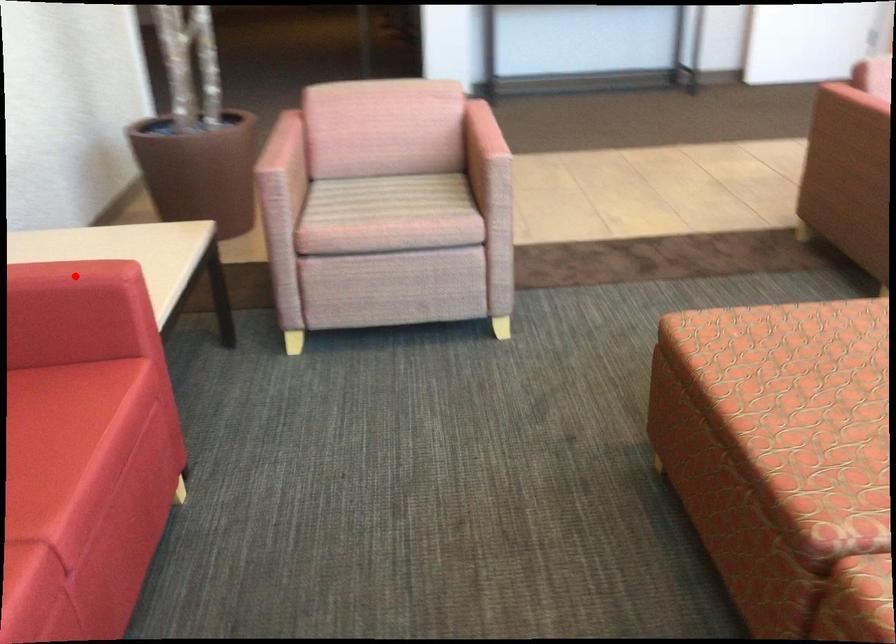
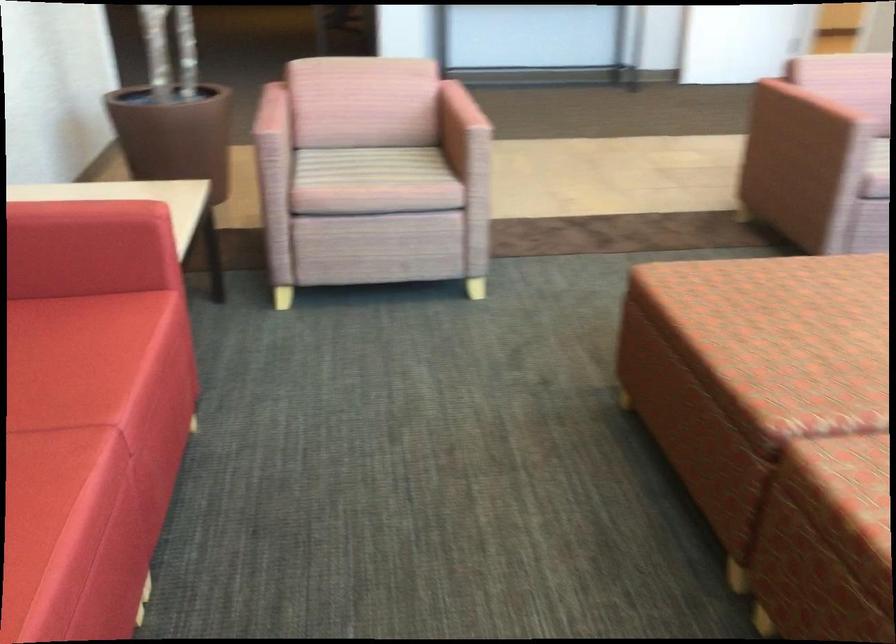
Where in the second image is the point corresponding to the highlighted location from the first image?

(108, 211)